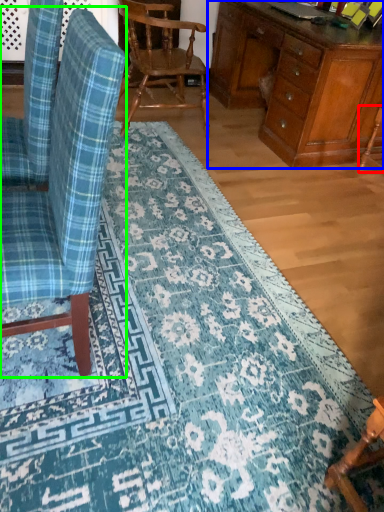
Question: Estimate the real-world distances between objects in this image. Which object is farther from armchair (highlighted by a red box), desk (highlighted by a blue box) or chair (highlighted by a green box)?

Choices:
 (A) desk
 (B) chair

Answer: (B)